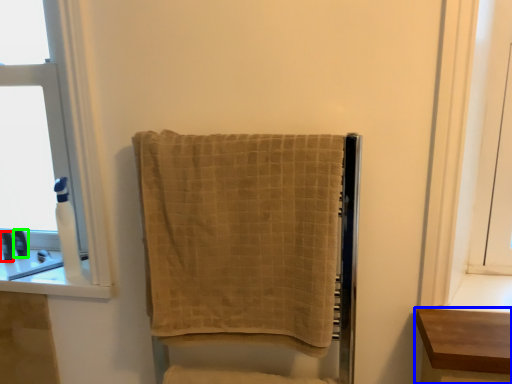
Question: Estimate the real-world distances between objects in this image. Which object is farther from toiletry (highlighted by a red box), furniture (highlighted by a blue box) or toiletry (highlighted by a green box)?

Choices:
 (A) furniture
 (B) toiletry

Answer: (A)